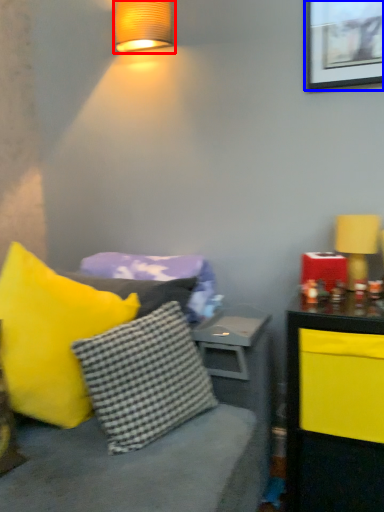
Question: Which of the following is the closest to the observer, lamp (highlighted by a red box) or picture frame (highlighted by a blue box)?

Choices:
 (A) lamp
 (B) picture frame

Answer: (B)